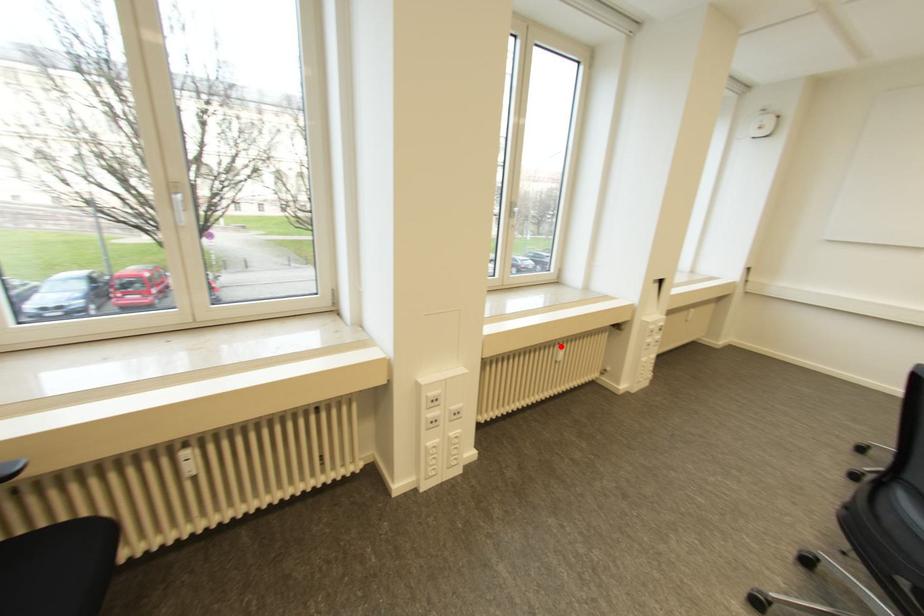
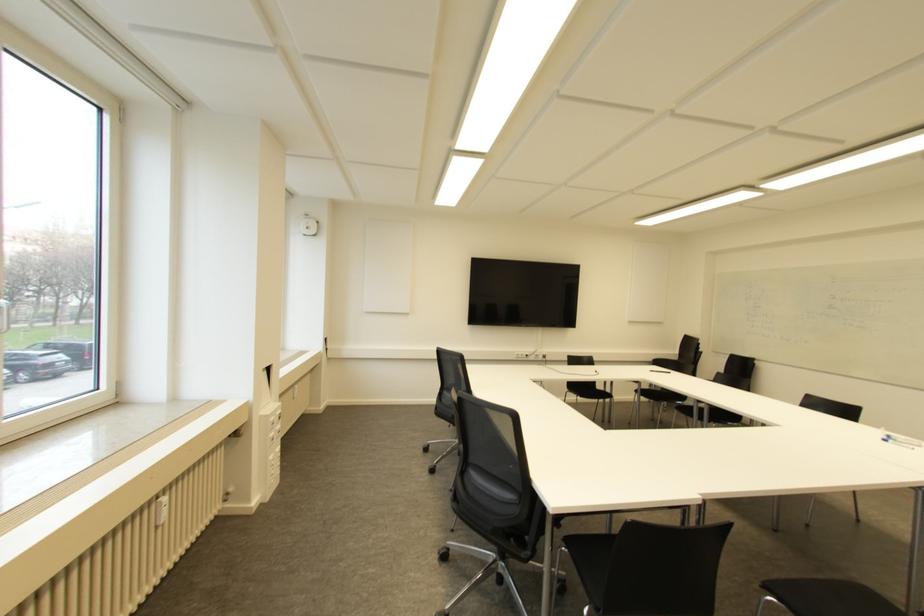
Question: I am providing you with two images of the same scene from different viewpoints. In image1, a red point is highlighted. Considering the same 3D point in image2, which of the following is correct?

Choices:
 (A) It is closer
 (B) It is farther

Answer: (A)